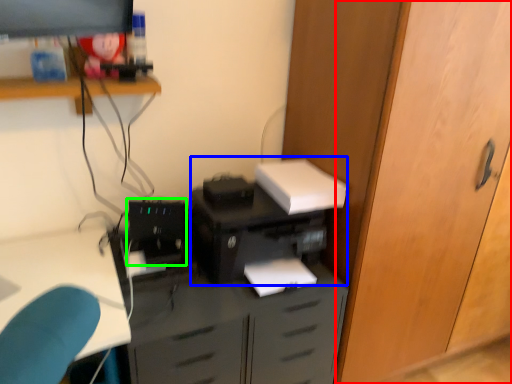
Question: Estimate the real-world distances between objects in this image. Which object is closer to door (highlighted by a red box), printer (highlighted by a blue box) or computer tower (highlighted by a green box)?

Choices:
 (A) printer
 (B) computer tower

Answer: (A)